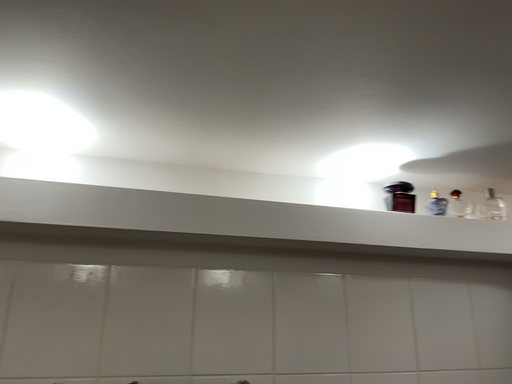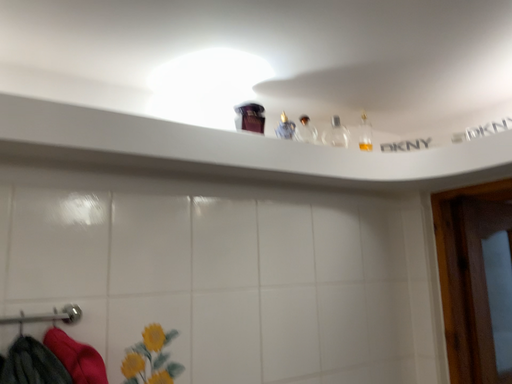
Question: How did the camera likely rotate when shooting the video?

Choices:
 (A) rotated right
 (B) rotated left

Answer: (A)